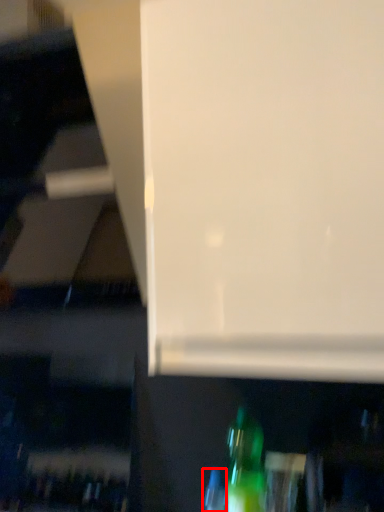
Question: From the image's perspective, where is bottle (annotated by the red box) located in relation to bottle in the image?

Choices:
 (A) below
 (B) above

Answer: (A)